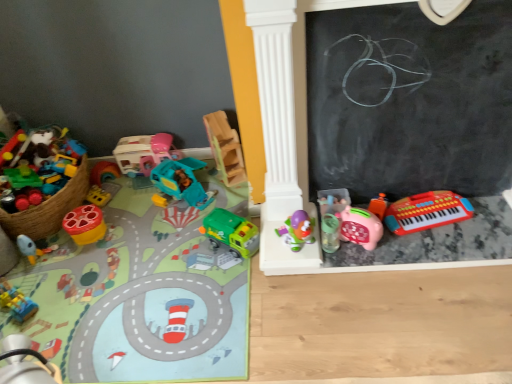
The width and height of the screenshot is (512, 384). Find the location of `vacant area that lies between translucent plastic playhouse at center-left, the 5th toy viewed from the left, and shiny plastic toy at left, arranged as the 3th toy when viewed from the left`. vacant area that lies between translucent plastic playhouse at center-left, the 5th toy viewed from the left, and shiny plastic toy at left, arranged as the 3th toy when viewed from the left is located at coordinates (125, 200).